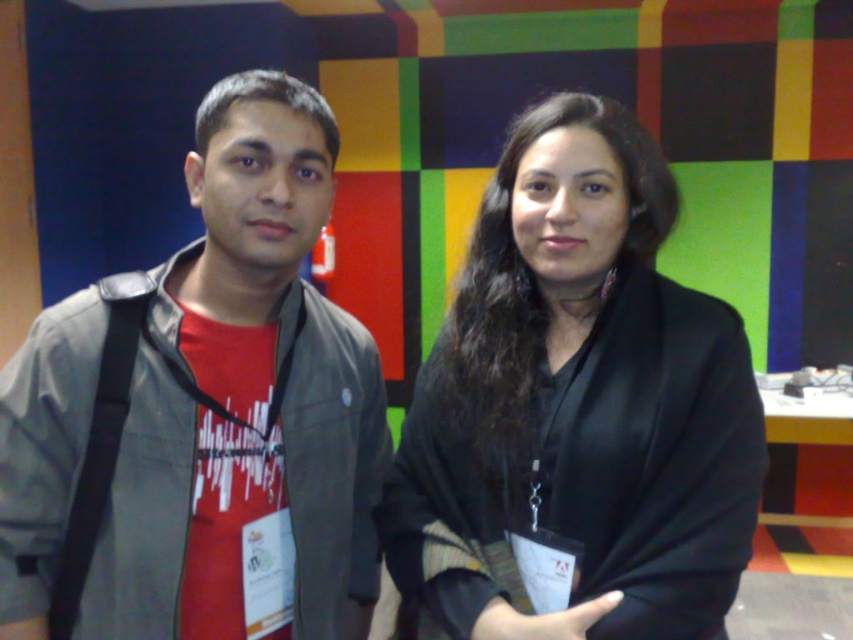
You are a photographer trying to adjust the focus of your camera. You notice two points in the image at coordinates point (151,506) and point (720,620). Which point should you focus on first if you want to capture the closest object to the camera?

You should focus on point (151,506) first because it is closer to the camera than point (720,620).

You are a photographer standing 40 inches away from the wall. You want to take a closeup shot of the matte gray jacket at left without moving the camera. Is the jacket within your current camera range?

The matte gray jacket at left is 37.35 inches away from the viewer, which is within the 40 inches range. Therefore, the jacket is within the camera range and can be captured in a closeup shot.